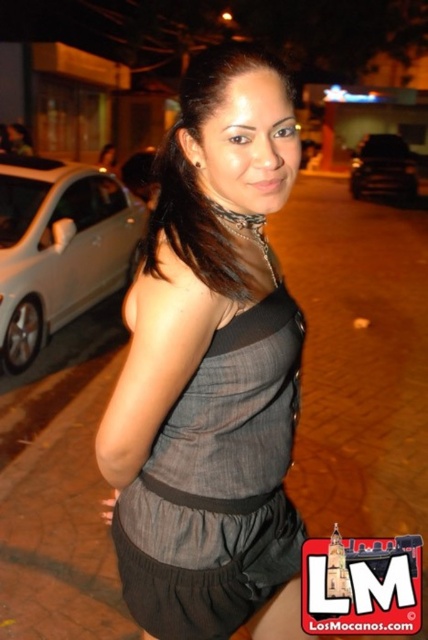
You are a fashion designer observing a model wearing two dresses in the image. The dresses are labeled as the matte gray dress at center and the matte black dress at center. Which dress is located lower on the model?

The matte gray dress at center is positioned under the matte black dress at center, so the matte gray dress at center is lower on the model.

You are a photographer setting up for a portrait. You want to capture the matte gray dress at center clearly while keeping the background slightly blurred. Given the camera is focused at 84.06 centimeters, will the dress be in focus?

The distance of matte gray dress at center from camera is 84.06 centimeters, so if the camera is focused at 84.06 centimeters, the dress will be in focus.

You are a photographer setting up for an outdoor event. You have a spotlight that can only illuminate a specific point in the scene. The spotlight is set to focus on the point at coordinates (196, 176). What object will be highlighted by the spotlight?

The spotlight will highlight the matte black dress at center located at point (196, 176).